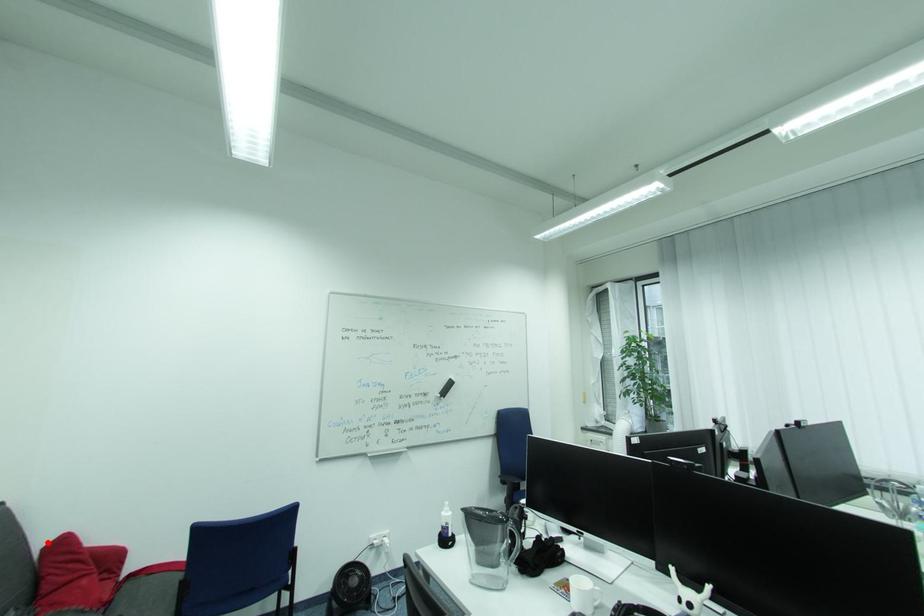
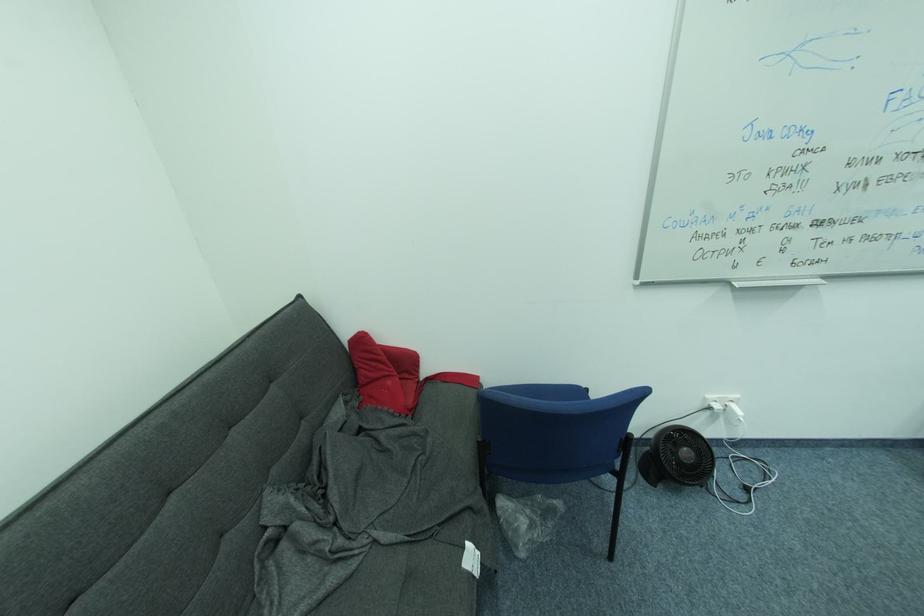
The point at the highlighted location is marked in the first image. Where is the corresponding point in the second image?

(353, 336)